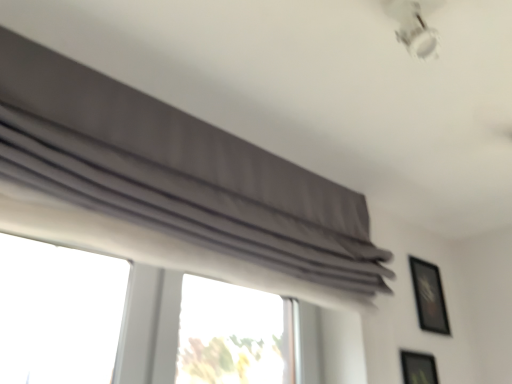
Question: Considering the relative sizes of gray fabric curtain at upper center and matte black picture frame at lower right, arranged as the second picture frame when viewed from the back, in the image provided, is gray fabric curtain at upper center smaller than matte black picture frame at lower right, arranged as the second picture frame when viewed from the back,?

Choices:
 (A) yes
 (B) no

Answer: (B)

Question: Does gray fabric curtain at upper center come behind matte black picture frame at lower right, which is counted as the 1th picture frame, starting from the front?

Choices:
 (A) no
 (B) yes

Answer: (A)

Question: Considering the relative sizes of gray fabric curtain at upper center and matte black picture frame at lower right, which is counted as the 1th picture frame, starting from the front, in the image provided, is gray fabric curtain at upper center taller than matte black picture frame at lower right, which is counted as the 1th picture frame, starting from the front,?

Choices:
 (A) no
 (B) yes

Answer: (B)

Question: From a real-world perspective, is gray fabric curtain at upper center on top of matte black picture frame at lower right, arranged as the second picture frame when viewed from the back?

Choices:
 (A) yes
 (B) no

Answer: (A)

Question: Is gray fabric curtain at upper center bigger than matte black picture frame at lower right, arranged as the second picture frame when viewed from the back?

Choices:
 (A) no
 (B) yes

Answer: (B)

Question: Is gray fabric curtain at upper center located outside matte black picture frame at lower right, the 2th picture frame when ordered from top to bottom?

Choices:
 (A) yes
 (B) no

Answer: (A)

Question: Can you confirm if black glossy picture frame at upper right, acting as the 1th picture frame starting from the top, is bigger than matte black picture frame at lower right, arranged as the second picture frame when viewed from the back?

Choices:
 (A) no
 (B) yes

Answer: (B)

Question: Is black glossy picture frame at upper right, acting as the 1th picture frame starting from the back, not close to matte black picture frame at lower right, acting as the 1th picture frame starting from the bottom?

Choices:
 (A) yes
 (B) no

Answer: (B)

Question: Does black glossy picture frame at upper right, which appears as the second picture frame when ordered from the bottom, have a greater width compared to matte black picture frame at lower right, acting as the 1th picture frame starting from the bottom?

Choices:
 (A) yes
 (B) no

Answer: (A)

Question: From a real-world perspective, is black glossy picture frame at upper right, which ranks as the 2th picture frame in front-to-back order, located beneath matte black picture frame at lower right, which is counted as the 1th picture frame, starting from the front?

Choices:
 (A) yes
 (B) no

Answer: (B)

Question: From the image's perspective, is black glossy picture frame at upper right, acting as the 1th picture frame starting from the top, above matte black picture frame at lower right, which is counted as the 1th picture frame, starting from the front?

Choices:
 (A) no
 (B) yes

Answer: (B)

Question: Can you confirm if black glossy picture frame at upper right, acting as the 1th picture frame starting from the top, is thinner than matte black picture frame at lower right, the 2th picture frame when ordered from top to bottom?

Choices:
 (A) no
 (B) yes

Answer: (A)

Question: Is black glossy picture frame at upper right, which ranks as the 2th picture frame in front-to-back order, directly adjacent to gray fabric curtain at upper center?

Choices:
 (A) yes
 (B) no

Answer: (B)